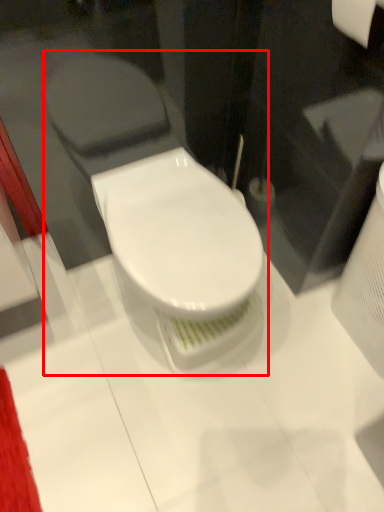
Question: Considering the relative positions of toilet (annotated by the red box) and toilet paper in the image provided, where is toilet (annotated by the red box) located with respect to the staircase?

Choices:
 (A) left
 (B) right

Answer: (A)